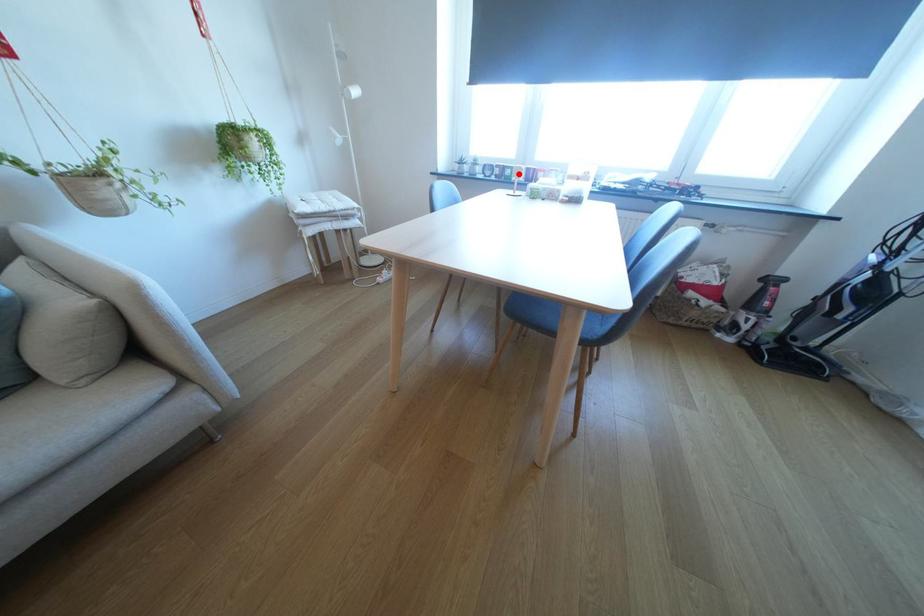
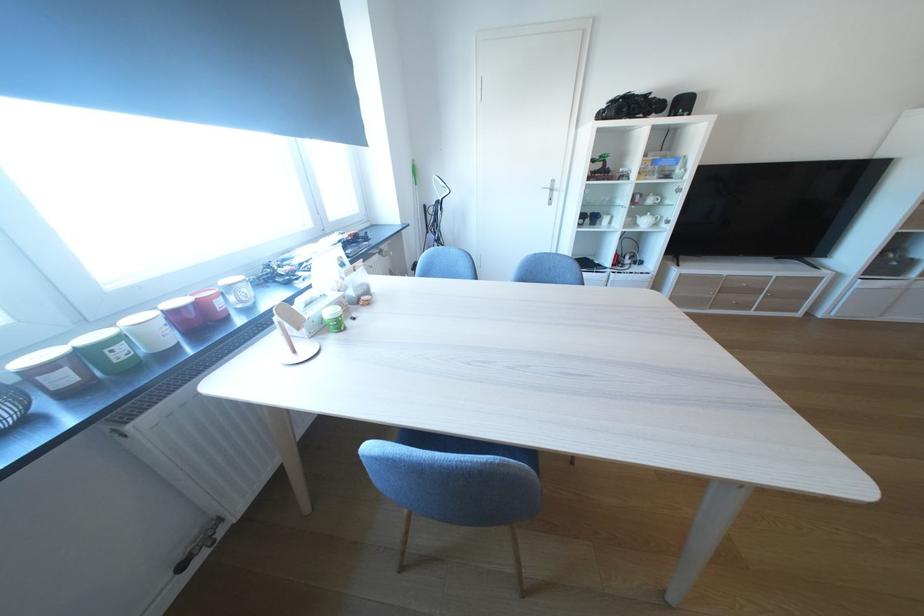
Question: A red point is marked in image1. In image2, is the corresponding 3D point closer to the camera or farther? Reply with the corresponding letter.

Choices:
 (A) The corresponding 3D point is closer.
 (B) The corresponding 3D point is farther.

Answer: (B)